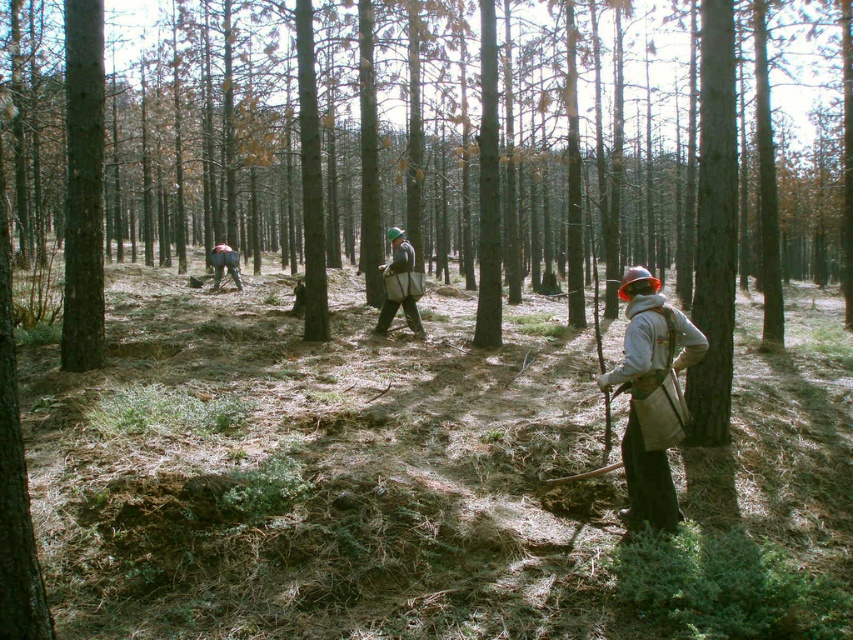
Can you confirm if matte gray jacket at center is positioned to the left of dark gray uniform at center?

No, matte gray jacket at center is not to the left of dark gray uniform at center.

Is matte gray jacket at center taller than dark gray uniform at center?

Yes, matte gray jacket at center is taller than dark gray uniform at center.

The image size is (853, 640). Identify the location of matte gray jacket at center. (404, 314).

Where is `matte gray jacket at center`? The image size is (853, 640). matte gray jacket at center is located at coordinates (404, 314).

Which is above, dark brown wood at left or dark gray uniform at center?

dark brown wood at left is higher up.

Between dark brown wood at left and dark gray uniform at center, which one has more height?

dark brown wood at left is taller.

What do you see at coordinates (83, 188) in the screenshot? I see `dark brown wood at left` at bounding box center [83, 188].

At what (x,y) coordinates should I click in order to perform the action: click on dark brown wood at left. Please return your answer as a coordinate pair (x, y). Looking at the image, I should click on (83, 188).

Between dark brown wood at left and matte gray jacket at center, which one appears on the right side from the viewer's perspective?

matte gray jacket at center

Is dark brown wood at left wider than matte gray jacket at center?

Incorrect, dark brown wood at left's width does not surpass matte gray jacket at center's.

What are the coordinates of `dark brown wood at left` in the screenshot? It's located at (83, 188).